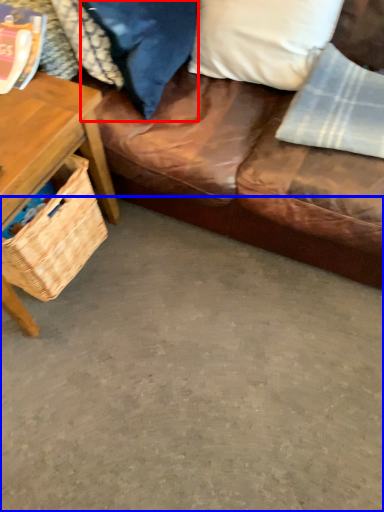
Question: Which object appears closest to the camera in this image, pillow (highlighted by a red box) or concrete (highlighted by a blue box)?

Choices:
 (A) pillow
 (B) concrete

Answer: (B)